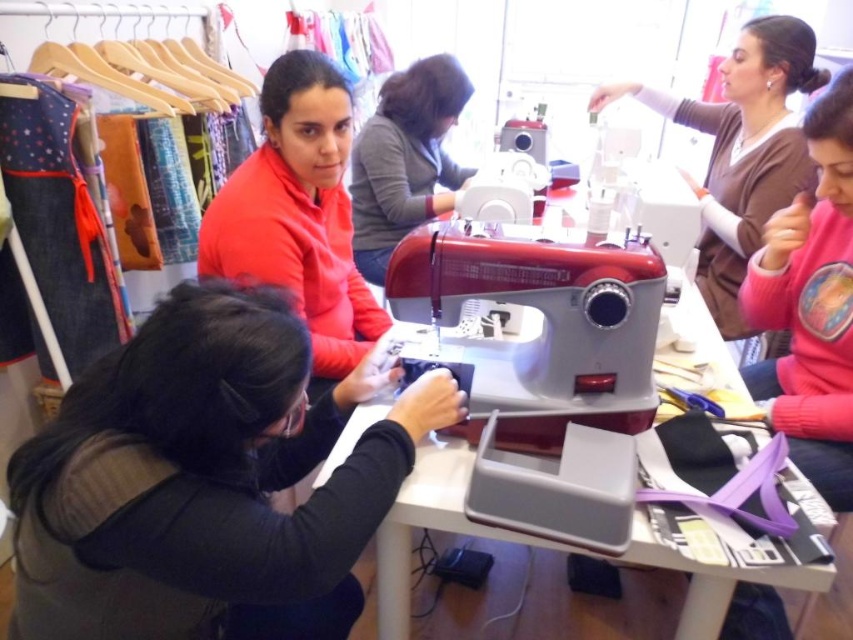
Question: Where is white plastic table at center located in relation to matte gray sewing machine at center in the image?

Choices:
 (A) below
 (B) above

Answer: (A)

Question: Which of the following is the farthest from the observer?

Choices:
 (A) metallic silver sewing machine at center
 (B) pink fleece sweater at upper right
 (C) white plastic table at center
 (D) black matte fabric at lower left

Answer: (B)

Question: Is black matte fabric at lower left closer to camera compared to metallic silver sewing machine at center?

Choices:
 (A) yes
 (B) no

Answer: (A)

Question: Can you confirm if pink fleece sweater at upper right is smaller than white plastic table at center?

Choices:
 (A) yes
 (B) no

Answer: (A)

Question: Which point appears closest to the camera in this image?

Choices:
 (A) (694, 308)
 (B) (404, 116)
 (C) (490, 346)

Answer: (C)

Question: Among these points, which one is farthest from the camera?

Choices:
 (A) (273, 419)
 (B) (408, 145)
 (C) (843, 348)

Answer: (B)